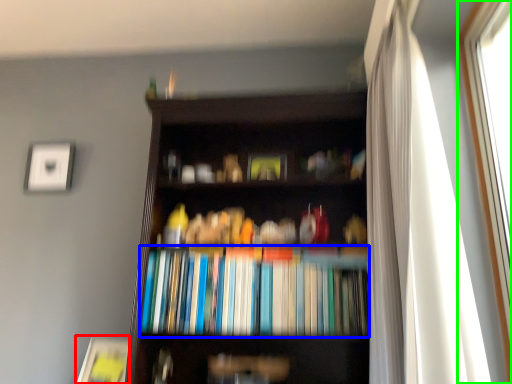
Question: Estimate the real-world distances between objects in this image. Which object is farther from paperback book (highlighted by a red box), book (highlighted by a blue box) or window (highlighted by a green box)?

Choices:
 (A) book
 (B) window

Answer: (B)